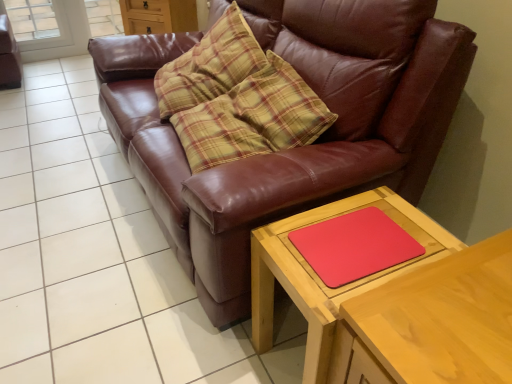
Question: Considering the positions of wooden table at lower right, which is counted as the 2th table, starting from the right, and brown leather couch at center in the image, is wooden table at lower right, which is counted as the 2th table, starting from the right, taller or shorter than brown leather couch at center?

Choices:
 (A) short
 (B) tall

Answer: (A)

Question: Is wooden table at lower right, the first table positioned from the left, spatially inside brown leather couch at center, or outside of it?

Choices:
 (A) inside
 (B) outside

Answer: (B)

Question: Which object is the closest to the brown leather couch at center?

Choices:
 (A) matte brown dresser at upper center
 (B) matte brown swivel chair at upper left
 (C) wooden table at lower right, placed as the second table when sorted from left to right
 (D) rubberized red mouse pad at lower right
 (E) wooden table at lower right, which is counted as the 2th table, starting from the right

Answer: (E)

Question: Estimate the real-world distances between objects in this image. Which object is farther from the brown leather couch at center?

Choices:
 (A) matte brown dresser at upper center
 (B) wooden table at lower right, which is the 1th table from right to left
 (C) rubberized red mouse pad at lower right
 (D) matte brown swivel chair at upper left
 (E) wooden table at lower right, the first table positioned from the left

Answer: (D)